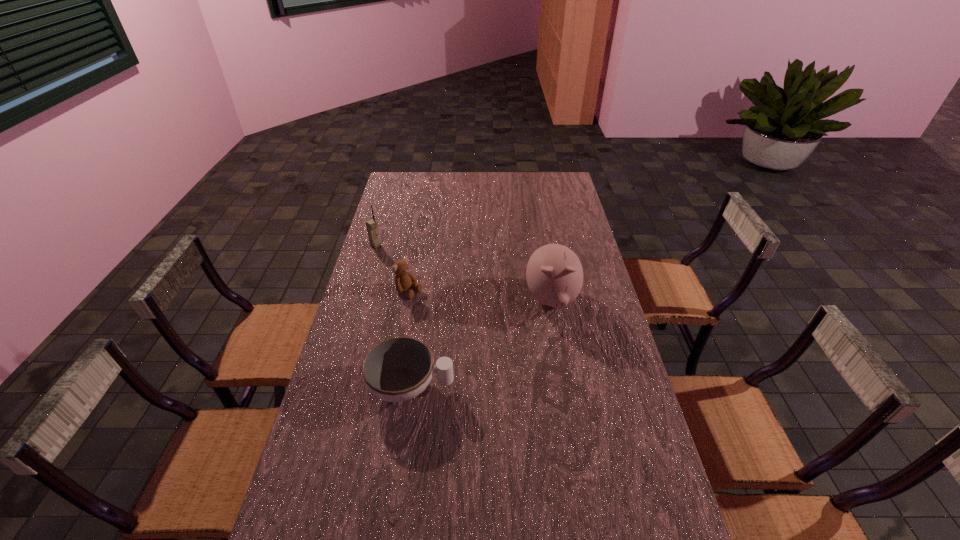
This screenshot has width=960, height=540. I want to click on vacant space that is in between the piggy bank and the chinaware, so click(481, 343).

You are a GUI agent. You are given a task and a screenshot of the screen. Output one action in this format:
    pyautogui.click(x=<x>, y=<y>)
    Task: Click on the vacant area that lies between the shortest object and the piggy bank
    
    Given the screenshot: What is the action you would take?
    pyautogui.click(x=481, y=343)

This screenshot has width=960, height=540. I want to click on object that is the third closest to the rightmost object, so click(371, 225).

Locate an element on the screen. The image size is (960, 540). object that stands as the third closest to the nearest object is located at coordinates (371, 225).

The image size is (960, 540). I want to click on vacant space that satisfies the following two spatial constraints: 1. on the front side of the nearest object; 2. on the side with the handle of the teddy bear, so click(x=393, y=387).

Locate an element on the screen. The height and width of the screenshot is (540, 960). vacant region that satisfies the following two spatial constraints: 1. on the front side of the teddy bear; 2. on the side with the handle of the shortest object is located at coordinates (393, 387).

What are the coordinates of `free space in the image that satisfies the following two spatial constraints: 1. on the front side of the nearest object; 2. on the side with the handle of the teddy bear` in the screenshot? It's located at click(x=393, y=387).